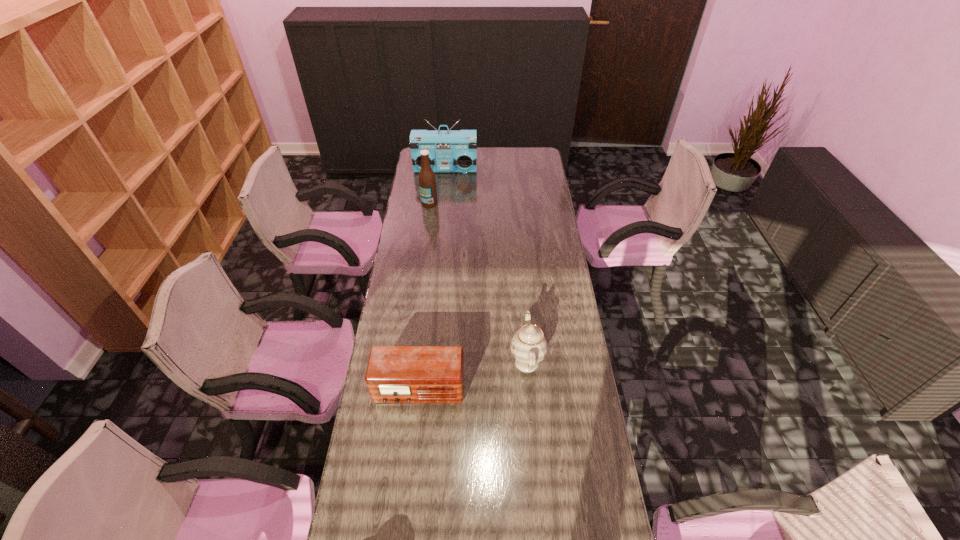
Locate an element on the screen. This screenshot has height=540, width=960. free region at the far right corner of the desktop is located at coordinates (540, 160).

I want to click on empty space that is in between the taller radio receiver and the shortest object, so click(432, 280).

The height and width of the screenshot is (540, 960). What are the coordinates of `free point between the shortest object and the second shortest object` in the screenshot? It's located at (473, 376).

Where is `free space that is in between the farther radio receiver and the beer bottle`? free space that is in between the farther radio receiver and the beer bottle is located at coordinates (438, 186).

You are a GUI agent. You are given a task and a screenshot of the screen. Output one action in this format:
    pyautogui.click(x=<x>, y=<y>)
    Task: Click on the empty space that is in between the third nearest object and the taller radio receiver
    This screenshot has height=540, width=960.
    Given the screenshot: What is the action you would take?
    pyautogui.click(x=438, y=186)

Where is `blank region between the chinaware and the farther radio receiver`? The width and height of the screenshot is (960, 540). blank region between the chinaware and the farther radio receiver is located at coordinates (486, 266).

I want to click on vacant space that's between the chinaware and the second farthest object, so click(478, 283).

The width and height of the screenshot is (960, 540). I want to click on object that is the third nearest to the rightmost object, so click(449, 150).

Locate an element on the screen. object that is the second closest one to the chinaware is located at coordinates (427, 182).